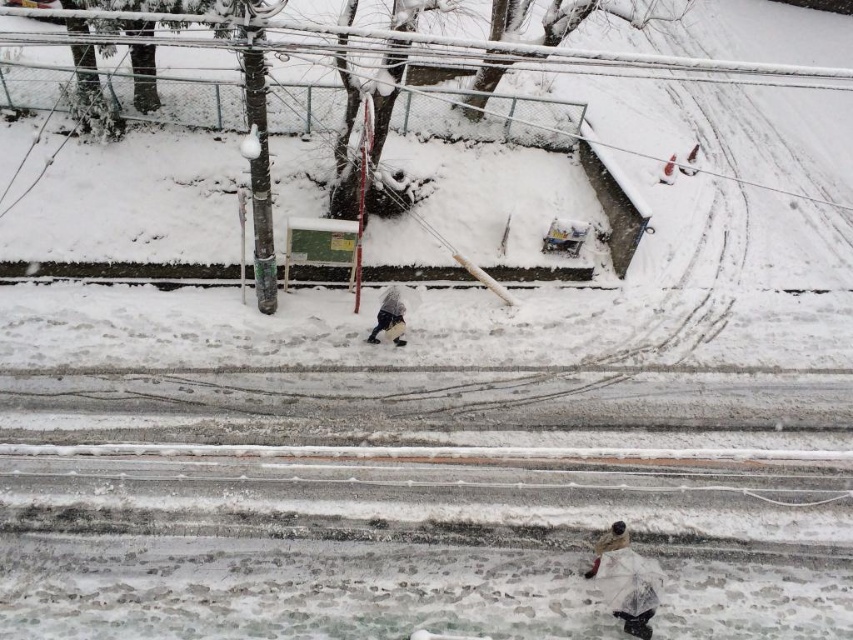
In the scene shown: Which is above, white matte umbrella at lower right or dark gray fabric jacket at center?

dark gray fabric jacket at center is above.

Find the location of a particular element. The image size is (853, 640). white matte umbrella at lower right is located at coordinates (625, 580).